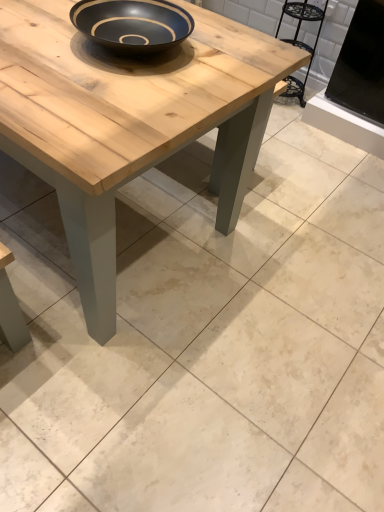
This screenshot has width=384, height=512. What are the coordinates of `natural wood coffee table at center` in the screenshot? It's located at (129, 122).

Looking at this image, measure the distance between point (x=266, y=47) and camera.

A distance of 1.24 meters exists between point (x=266, y=47) and camera.

What do you see at coordinates (129, 122) in the screenshot? I see `natural wood coffee table at center` at bounding box center [129, 122].

You are a GUI agent. You are given a task and a screenshot of the screen. Output one action in this format:
    pyautogui.click(x=<x>, y=<y>)
    Task: Click on the metallic black chair at upper right
    
    Given the screenshot: What is the action you would take?
    pyautogui.click(x=300, y=41)

The height and width of the screenshot is (512, 384). Describe the element at coordinates (300, 41) in the screenshot. I see `metallic black chair at upper right` at that location.

At what (x,y) coordinates should I click in order to perform the action: click on natural wood coffee table at center. Please return your answer as a coordinate pair (x, y). The height and width of the screenshot is (512, 384). Looking at the image, I should click on (129, 122).

Considering the relative positions of metallic black chair at upper right and natural wood coffee table at center in the image provided, is metallic black chair at upper right to the right of natural wood coffee table at center from the viewer's perspective?

Yes, metallic black chair at upper right is to the right of natural wood coffee table at center.

Consider the image. Relative to natural wood coffee table at center, is metallic black chair at upper right in front or behind?

Visually, metallic black chair at upper right is located behind natural wood coffee table at center.

Which point is more distant from viewer, (298, 44) or (146, 135)?

Point (298, 44)

From the image's perspective, which is above, metallic black chair at upper right or natural wood coffee table at center?

metallic black chair at upper right is shown above in the image.

From a real-world perspective, is metallic black chair at upper right under natural wood coffee table at center?

Yes, from a real-world perspective, metallic black chair at upper right is below natural wood coffee table at center.

Considering the relative sizes of metallic black chair at upper right and natural wood coffee table at center in the image provided, is metallic black chair at upper right wider than natural wood coffee table at center?

No, metallic black chair at upper right is not wider than natural wood coffee table at center.

Is metallic black chair at upper right taller than natural wood coffee table at center?

In fact, metallic black chair at upper right may be shorter than natural wood coffee table at center.

Between metallic black chair at upper right and natural wood coffee table at center, which one has larger size?

natural wood coffee table at center is bigger.

Would you say metallic black chair at upper right is inside or outside natural wood coffee table at center?

metallic black chair at upper right exists outside the volume of natural wood coffee table at center.

Is there a large distance between metallic black chair at upper right and natural wood coffee table at center?

Indeed, metallic black chair at upper right is not near natural wood coffee table at center.

Could you tell me if metallic black chair at upper right is facing natural wood coffee table at center?

Yes, metallic black chair at upper right faces towards natural wood coffee table at center.

How many degrees apart are the facing directions of metallic black chair at upper right and natural wood coffee table at center?

94.2 degrees.

Find the location of a particular element. This screenshot has width=384, height=512. coffee table above the metallic black chair at upper right (from a real-world perspective) is located at coordinates (129, 122).

Based on the photo, in the image, is natural wood coffee table at center on the left side or the right side of metallic black chair at upper right?

natural wood coffee table at center is positioned on metallic black chair at upper right's left side.

Which object is closer to the camera taking this photo, natural wood coffee table at center or metallic black chair at upper right?

natural wood coffee table at center is closer to the camera.

Does point (88, 167) appear closer or farther from the camera than point (311, 16)?

Point (88, 167).

From the image's perspective, which one is positioned lower, natural wood coffee table at center or metallic black chair at upper right?

natural wood coffee table at center, from the image's perspective.

From a real-world perspective, which object rests below the other?

From a 3D spatial view, metallic black chair at upper right is below.

Between natural wood coffee table at center and metallic black chair at upper right, which one has smaller width?

metallic black chair at upper right.

Which of these two, natural wood coffee table at center or metallic black chair at upper right, stands shorter?

metallic black chair at upper right.

Between natural wood coffee table at center and metallic black chair at upper right, which one has smaller size?

metallic black chair at upper right is smaller.

Is natural wood coffee table at center positioned beyond the bounds of metallic black chair at upper right?

Yes.

Are natural wood coffee table at center and metallic black chair at upper right beside each other?

No, natural wood coffee table at center is not next to metallic black chair at upper right.

Is natural wood coffee table at center oriented away from metallic black chair at upper right?

No, natural wood coffee table at center's orientation is not away from metallic black chair at upper right.

What's the angular difference between natural wood coffee table at center and metallic black chair at upper right's facing directions?

natural wood coffee table at center and metallic black chair at upper right are facing 94.2 degrees away from each other.

This screenshot has width=384, height=512. I want to click on chair located above the natural wood coffee table at center (from the image's perspective), so click(x=300, y=41).

Where is `chair that appears below the natural wood coffee table at center (from a real-world perspective)`? The image size is (384, 512). chair that appears below the natural wood coffee table at center (from a real-world perspective) is located at coordinates [x=300, y=41].

The height and width of the screenshot is (512, 384). I want to click on coffee table in front of the metallic black chair at upper right, so click(129, 122).